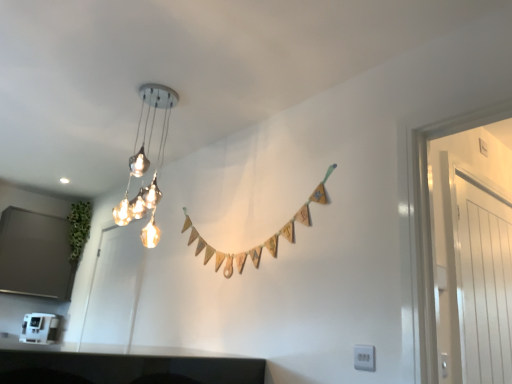
Question: Considering the relative sizes of matte white door at left, which is the 1th glass door in back-to-front order, and white glossy door at right, which ranks as the 1th glass door in front-to-back order, in the image provided, is matte white door at left, which is the 1th glass door in back-to-front order, smaller than white glossy door at right, which ranks as the 1th glass door in front-to-back order,?

Choices:
 (A) no
 (B) yes

Answer: (A)

Question: Does matte white door at left, which is the 1th glass door in back-to-front order, have a lesser height compared to white glossy door at right, which is counted as the first glass door, starting from the right?

Choices:
 (A) yes
 (B) no

Answer: (B)

Question: From the image's perspective, is matte white door at left, positioned as the second glass door in front-to-back order, beneath white glossy door at right, the second glass door from the back?

Choices:
 (A) no
 (B) yes

Answer: (B)

Question: Is matte white door at left, which is the 1th glass door in back-to-front order, at the right side of white glossy door at right, the second glass door from the back?

Choices:
 (A) no
 (B) yes

Answer: (A)

Question: From a real-world perspective, is matte white door at left, which is the 1th glass door in back-to-front order, physically above white glossy door at right, marked as the 2th glass door in a left-to-right arrangement?

Choices:
 (A) yes
 (B) no

Answer: (B)

Question: Considering the positions of metallic glass chandelier at upper center and matte white door at left, which appears as the 2th glass door when viewed from the right, in the image, is metallic glass chandelier at upper center wider or thinner than matte white door at left, which appears as the 2th glass door when viewed from the right,?

Choices:
 (A) wide
 (B) thin

Answer: (A)

Question: Is metallic glass chandelier at upper center to the left or to the right of matte white door at left, which appears as the 2th glass door when viewed from the right, in the image?

Choices:
 (A) right
 (B) left

Answer: (A)

Question: From a real-world perspective, relative to matte white door at left, positioned as the second glass door in front-to-back order, is metallic glass chandelier at upper center vertically above or below?

Choices:
 (A) below
 (B) above

Answer: (B)

Question: Is metallic glass chandelier at upper center inside or outside of matte white door at left, which is the 1th glass door in back-to-front order?

Choices:
 (A) inside
 (B) outside

Answer: (B)

Question: From their relative heights in the image, would you say white glossy door at right, the second glass door from the back, is taller or shorter than metallic glass chandelier at upper center?

Choices:
 (A) short
 (B) tall

Answer: (B)

Question: Relative to metallic glass chandelier at upper center, is white glossy door at right, which ranks as the 1th glass door in front-to-back order, in front or behind?

Choices:
 (A) front
 (B) behind

Answer: (A)

Question: Is white glossy door at right, marked as the 2th glass door in a left-to-right arrangement, situated inside metallic glass chandelier at upper center or outside?

Choices:
 (A) inside
 (B) outside

Answer: (B)

Question: Considering the positions of white glossy door at right, marked as the 2th glass door in a left-to-right arrangement, and metallic glass chandelier at upper center in the image, is white glossy door at right, marked as the 2th glass door in a left-to-right arrangement, wider or thinner than metallic glass chandelier at upper center?

Choices:
 (A) thin
 (B) wide

Answer: (A)

Question: Based on their sizes in the image, would you say white plastic electric outlet at lower right is bigger or smaller than white plastic coffee machine at lower left?

Choices:
 (A) small
 (B) big

Answer: (A)

Question: From the image's perspective, is white plastic electric outlet at lower right located above or below white plastic coffee machine at lower left?

Choices:
 (A) above
 (B) below

Answer: (A)